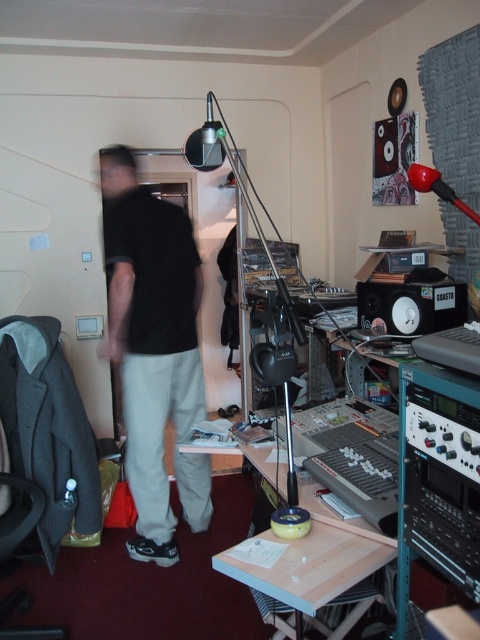
Does black cotton pants at left appear on the right side of black plastic speaker at center-right?

Incorrect, black cotton pants at left is not on the right side of black plastic speaker at center-right.

Who is higher up, black cotton pants at left or black plastic speaker at center-right?

black plastic speaker at center-right

Between point (154, 541) and point (383, 305), which one is positioned behind?

Point (154, 541)

At what (x,y) coordinates should I click in order to perform the action: click on black cotton pants at left. Please return your answer as a coordinate pair (x, y). The image size is (480, 640). Looking at the image, I should click on (151, 339).